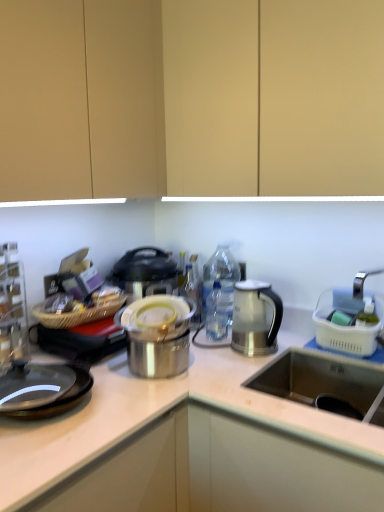
Question: Should I look upward or downward to see shiny metallic pot at center, placed as the 1th appliance when sorted from left to right?

Choices:
 (A) down
 (B) up

Answer: (A)

Question: From a real-world perspective, is white plastic basket at right, the first appliance positioned from the right, on shiny metallic pot at center, placed as the 1th appliance when sorted from left to right?

Choices:
 (A) no
 (B) yes

Answer: (B)

Question: Considering the relative sizes of white plastic basket at right, which appears as the 2th appliance when viewed from the left, and shiny metallic pot at center, placed as the 1th appliance when sorted from left to right, in the image provided, is white plastic basket at right, which appears as the 2th appliance when viewed from the left, shorter than shiny metallic pot at center, placed as the 1th appliance when sorted from left to right,?

Choices:
 (A) yes
 (B) no

Answer: (B)

Question: From a real-world perspective, is white plastic basket at right, which appears as the 2th appliance when viewed from the left, positioned under shiny metallic pot at center, positioned as the 2th appliance in right-to-left order, based on gravity?

Choices:
 (A) yes
 (B) no

Answer: (B)

Question: Can you confirm if white plastic basket at right, the first appliance positioned from the right, is taller than shiny metallic pot at center, positioned as the 2th appliance in right-to-left order?

Choices:
 (A) no
 (B) yes

Answer: (B)

Question: Is white plastic basket at right, the first appliance positioned from the right, not near shiny metallic pot at center, positioned as the 2th appliance in right-to-left order?

Choices:
 (A) no
 (B) yes

Answer: (A)

Question: Is shiny metallic pot at center, placed as the 1th appliance when sorted from left to right, completely or partially inside white plastic basket at right, which appears as the 2th appliance when viewed from the left?

Choices:
 (A) yes
 (B) no

Answer: (B)

Question: From a real-world perspective, is metallic glass shelf at left on top of matte wood cabinet at upper center?

Choices:
 (A) yes
 (B) no

Answer: (B)

Question: Can you confirm if metallic glass shelf at left is positioned to the left of matte wood cabinet at upper center?

Choices:
 (A) no
 (B) yes

Answer: (B)

Question: Does metallic glass shelf at left have a lesser width compared to matte wood cabinet at upper center?

Choices:
 (A) no
 (B) yes

Answer: (B)

Question: Can you confirm if metallic glass shelf at left is wider than matte wood cabinet at upper center?

Choices:
 (A) yes
 (B) no

Answer: (B)

Question: Does metallic glass shelf at left come in front of matte wood cabinet at upper center?

Choices:
 (A) yes
 (B) no

Answer: (B)

Question: Could you tell me if metallic glass shelf at left is turned towards matte wood cabinet at upper center?

Choices:
 (A) yes
 (B) no

Answer: (B)

Question: Is shiny metallic pot at center, placed as the 1th appliance when sorted from left to right, touching white plastic basket at right, which appears as the 2th appliance when viewed from the left?

Choices:
 (A) yes
 (B) no

Answer: (B)